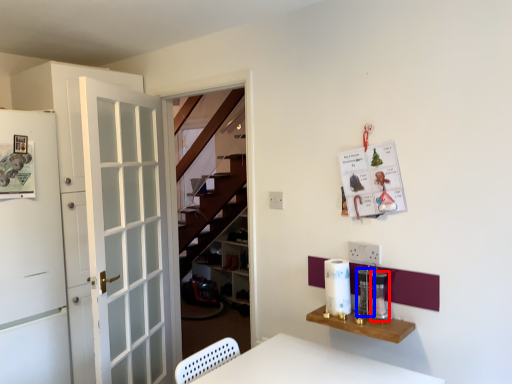
Question: Which object appears closest to the camera in this image, appliance (highlighted by a red box) or appliance (highlighted by a blue box)?

Choices:
 (A) appliance
 (B) appliance

Answer: (A)